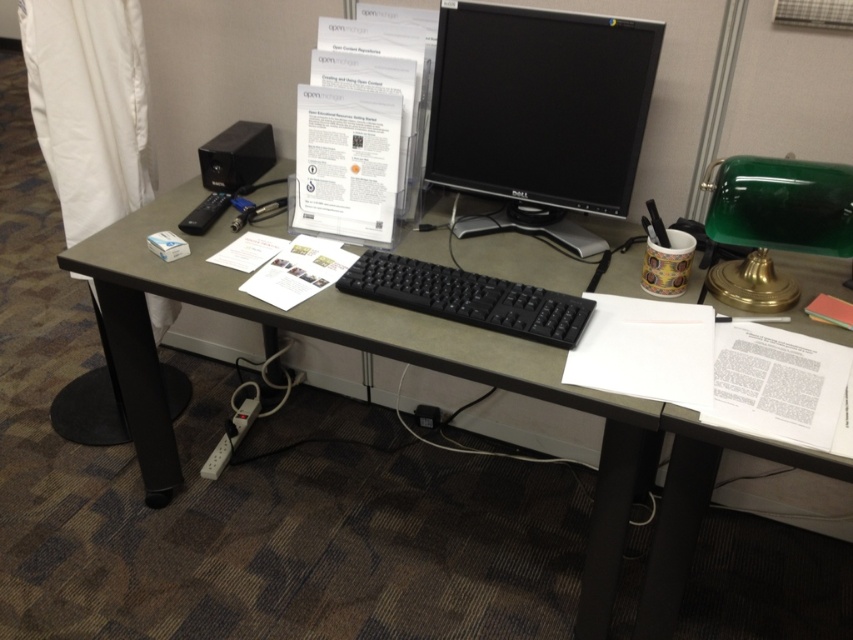
You are setting up a new monitor on the desk and need to place it next to the existing black matte keyboard at center. Based on the current setup, will the new monitor fit horizontally if it has the same width as the black glossy monitor at center?

The black glossy monitor at center has a lesser width compared to the black matte keyboard at center. Since the new monitor has the same width as the black glossy monitor at center, it will have a width smaller than the keyboard. Therefore, the new monitor will fit horizontally next to the black matte keyboard at center as it is narrower.

In the scene shown: You are setting up a new monitor for a client. The client wants to ensure that the new monitor will fit on their existing desk. Given the current setup, can you determine if the black glossy monitor at center will fit on the black plastic computer desk at center?

The black plastic computer desk at center has a larger size compared to the black glossy monitor at center, so the monitor will fit on the desk.